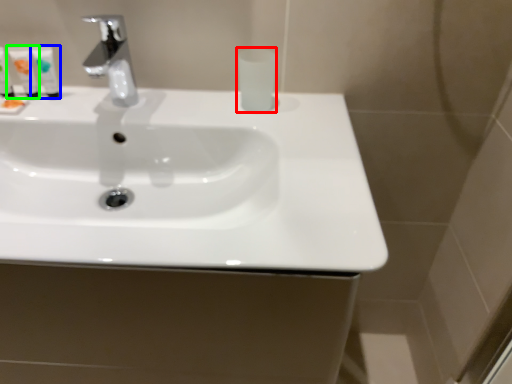
Question: Based on their relative distances, which object is nearer to mouthwash (highlighted by a red box)? Choose from mouthwash (highlighted by a blue box) and mouthwash (highlighted by a green box).

Choices:
 (A) mouthwash
 (B) mouthwash

Answer: (A)